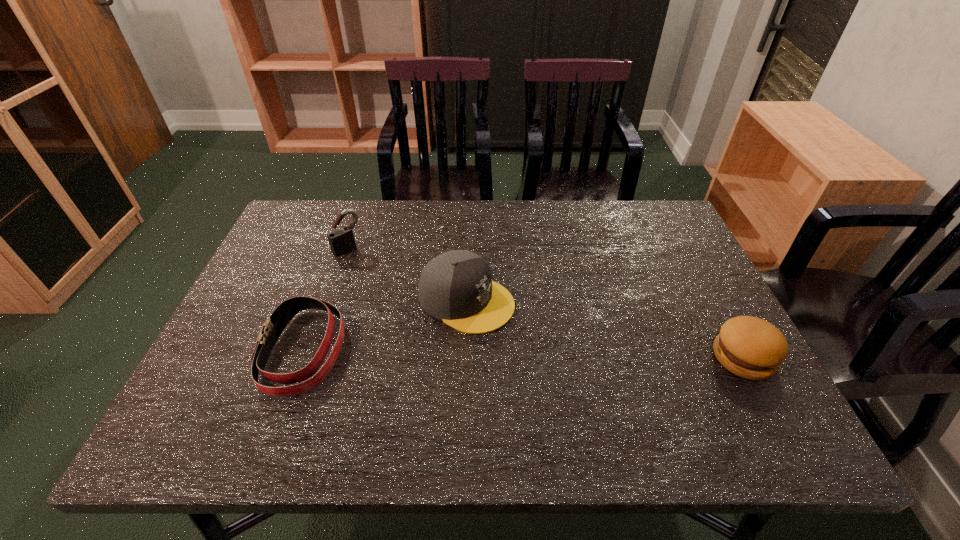
The image size is (960, 540). I want to click on dog collar, so click(273, 327).

In order to click on the rightmost object in this screenshot , I will do `click(752, 348)`.

This screenshot has height=540, width=960. What are the coordinates of `padlock` in the screenshot? It's located at (341, 241).

I want to click on cap, so click(x=456, y=287).

Where is `vacant region located on the back of the dog collar`? vacant region located on the back of the dog collar is located at coordinates (346, 233).

This screenshot has height=540, width=960. I want to click on vacant space located 0.190m on the back of the hamburger, so click(701, 278).

Locate an element on the screen. The height and width of the screenshot is (540, 960). blank space located with the keyhole on the front of the farthest object is located at coordinates (386, 285).

Locate an element on the screen. The image size is (960, 540). vacant space located with the keyhole on the front of the farthest object is located at coordinates (406, 303).

This screenshot has height=540, width=960. Find the location of `free space located 0.190m with the keyhole on the front of the farthest object`. free space located 0.190m with the keyhole on the front of the farthest object is located at coordinates (393, 291).

Where is `free space located 0.100m on the front-facing side of the third object from left to right`? This screenshot has width=960, height=540. free space located 0.100m on the front-facing side of the third object from left to right is located at coordinates (544, 336).